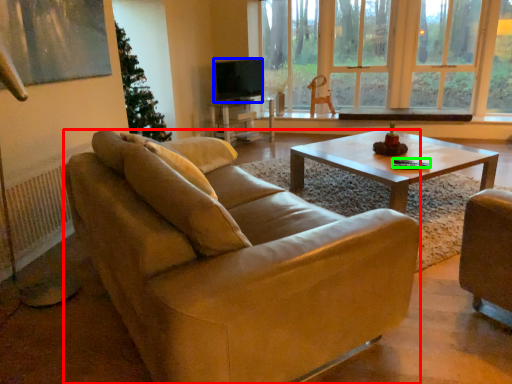
Question: Based on their relative distances, which object is farther from studio couch (highlighted by a red box)? Choose from television (highlighted by a blue box) and corded phone (highlighted by a green box).

Choices:
 (A) television
 (B) corded phone

Answer: (A)